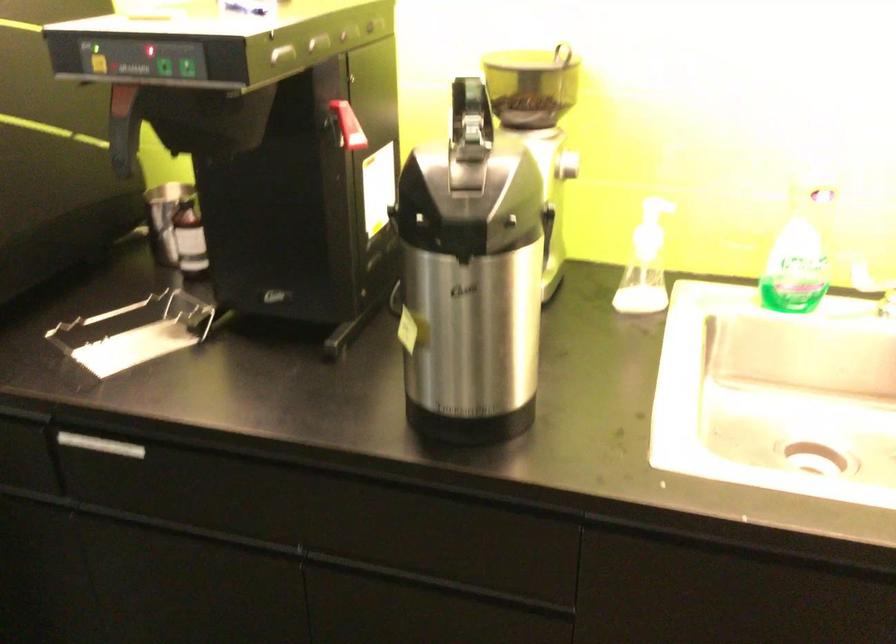
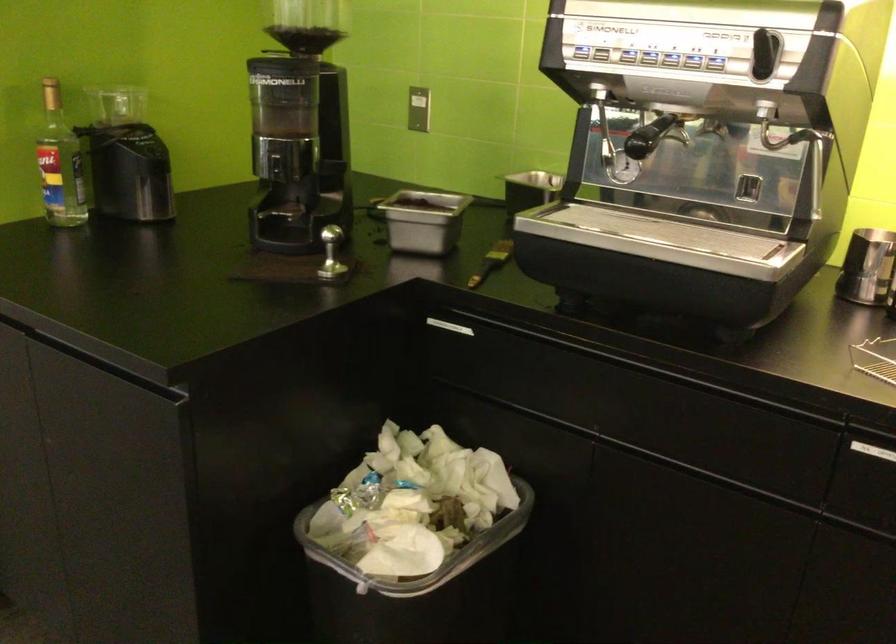
Question: How did the camera likely rotate?

Choices:
 (A) Left
 (B) Right
 (C) Up
 (D) Down

Answer: (A)